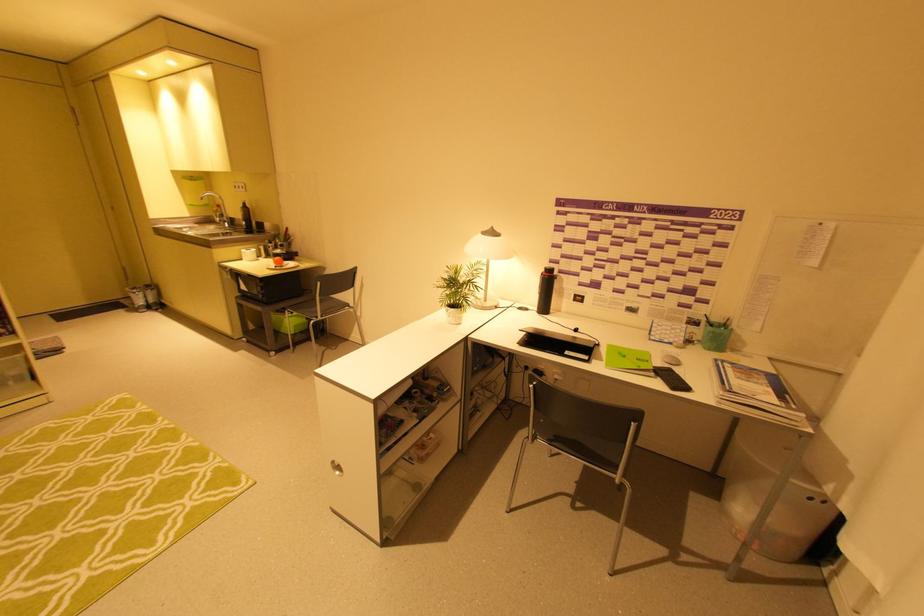
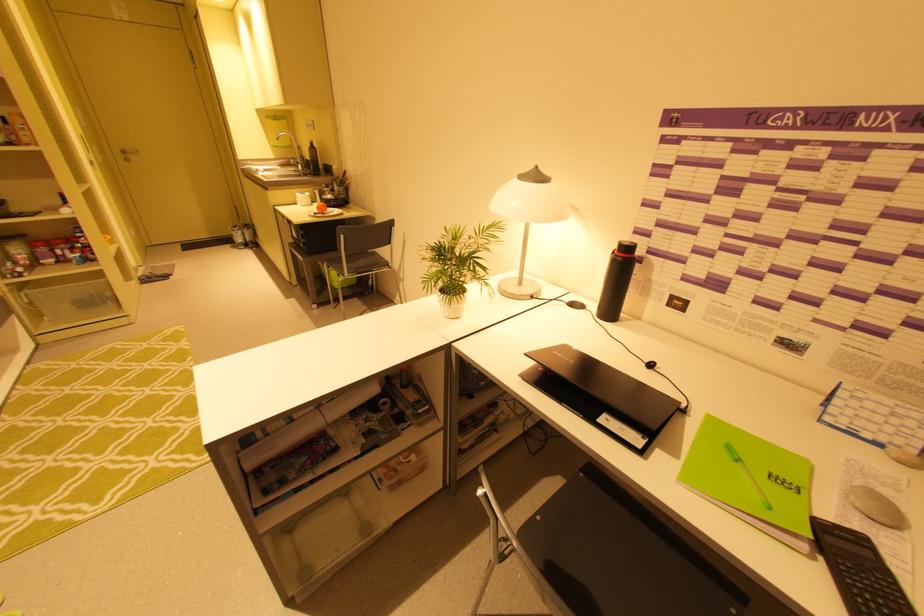
Where in the second image is the point corresponding to pixel 565 355 from the first image?

(596, 419)